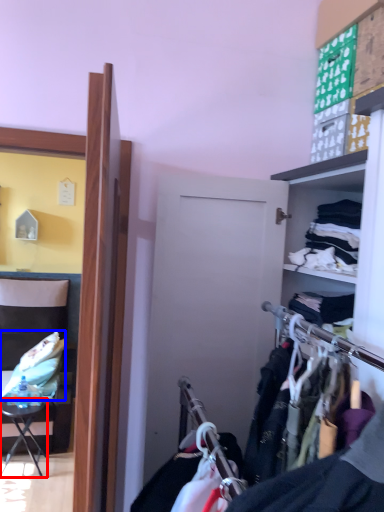
Question: Which point is further to the camera, table (highlighted by a red box) or clothing (highlighted by a blue box)?

Choices:
 (A) table
 (B) clothing

Answer: (B)